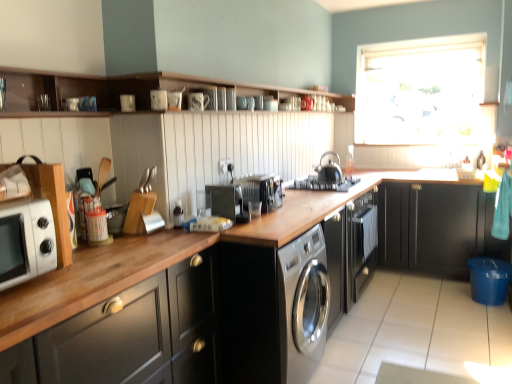
Question: From a real-world perspective, is satin silver toaster at center, arranged as the second appliance when viewed from the front, above or below white glossy microwave at left?

Choices:
 (A) below
 (B) above

Answer: (A)

Question: Would you say satin silver toaster at center, arranged as the second appliance when viewed from the front, is to the left or to the right of white glossy microwave at left in the picture?

Choices:
 (A) right
 (B) left

Answer: (A)

Question: Which object is positioned farthest from the wooden shelf at upper left?

Choices:
 (A) sleek stainless steel washing machine at center
 (B) satin black coffee maker at center, the 3th appliance when ordered from right to left
 (C) black matte cabinet at right, acting as the second cabinetry starting from the bottom
 (D) white glossy shelves at upper center, marked as the second cabinetry in a left-to-right arrangement
 (E) satin silver toaster at center, which appears as the 2th appliance when viewed from the back

Answer: (C)

Question: Which of these objects is positioned farthest from the white glossy shelves at upper center, marked as the second cabinetry in a left-to-right arrangement?

Choices:
 (A) satin silver toaster at center, which appears as the 2th appliance when viewed from the back
 (B) white sheer curtain at upper right
 (C) wooden shelf at upper left
 (D) satin black coffee maker at center, positioned as the 1th appliance in front-to-back order
 (E) white glossy microwave at left

Answer: (B)